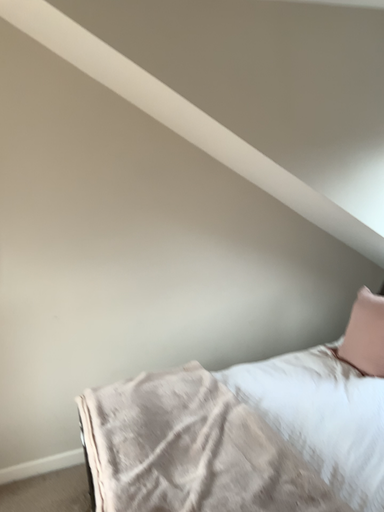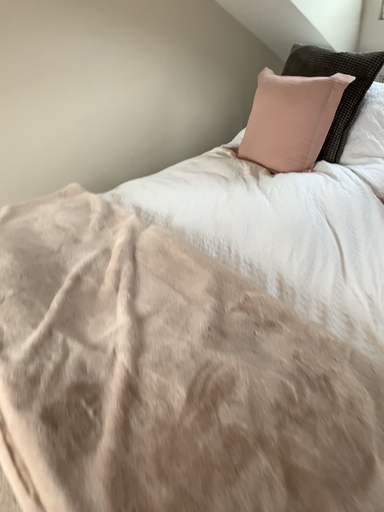
Question: Which way did the camera rotate in the video?

Choices:
 (A) rotated downward
 (B) rotated upward

Answer: (A)